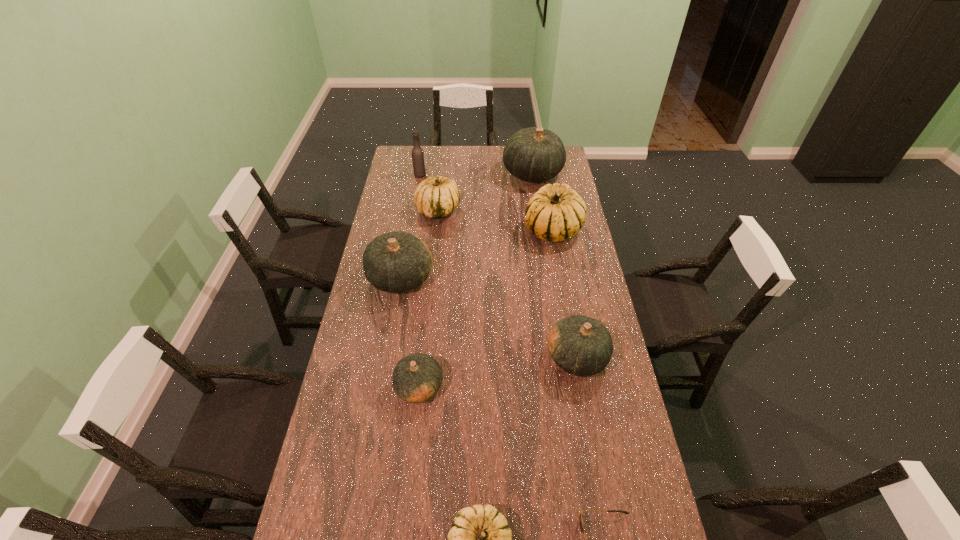
The image size is (960, 540). What are the coordinates of `free space located 0.300m on the label of the beer bottle` in the screenshot? It's located at (484, 175).

What are the coordinates of `blank space located on the back of the fourth nearest gourd` in the screenshot? It's located at (413, 205).

The width and height of the screenshot is (960, 540). Find the location of `free space located 0.280m on the front of the biggest white gourd`. free space located 0.280m on the front of the biggest white gourd is located at coordinates (565, 299).

Where is `vacant region located on the left of the second smallest orange gourd`? The width and height of the screenshot is (960, 540). vacant region located on the left of the second smallest orange gourd is located at coordinates (452, 357).

Locate an element on the screen. This screenshot has width=960, height=540. vacant space situated on the right of the leftmost white gourd is located at coordinates (545, 210).

Identify the location of vacant space located on the front of the smallest orange gourd. The width and height of the screenshot is (960, 540). (403, 531).

I want to click on object that is at the far edge, so click(533, 154).

Where is `beer bottle that is positioned at the left edge`? This screenshot has width=960, height=540. beer bottle that is positioned at the left edge is located at coordinates (418, 160).

This screenshot has height=540, width=960. Identify the location of object located at the far right corner. (533, 154).

In the image, there is a desktop. At what (x,y) coordinates should I click in order to perform the action: click on vacant area at the far edge. Please return your answer as a coordinate pair (x, y). The image size is (960, 540). Looking at the image, I should click on (483, 156).